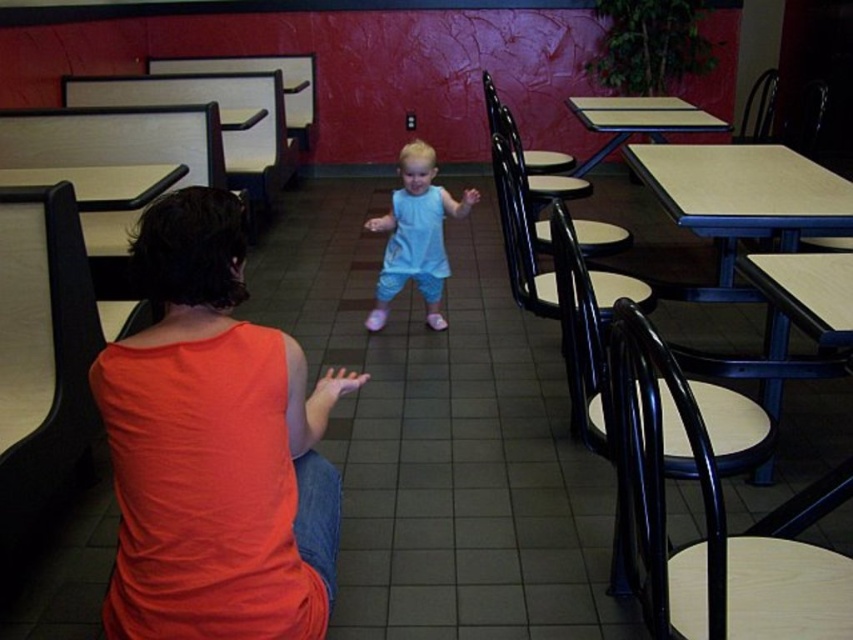
You are a photographer setting up a shoot in this dining area. You want to place a small prop between the orange cotton tank top at center and the black wood chair at right. Where should you position it to ensure it is between them?

The orange cotton tank top at center is in front of the black wood chair at right, so placing the prop between them would require positioning it in front of the black wood chair at right but behind the orange cotton tank top at center.

Looking at this image, what is located at the coordinates point (x=213, y=448)?

The orange cotton tank top at center is located at point (x=213, y=448).